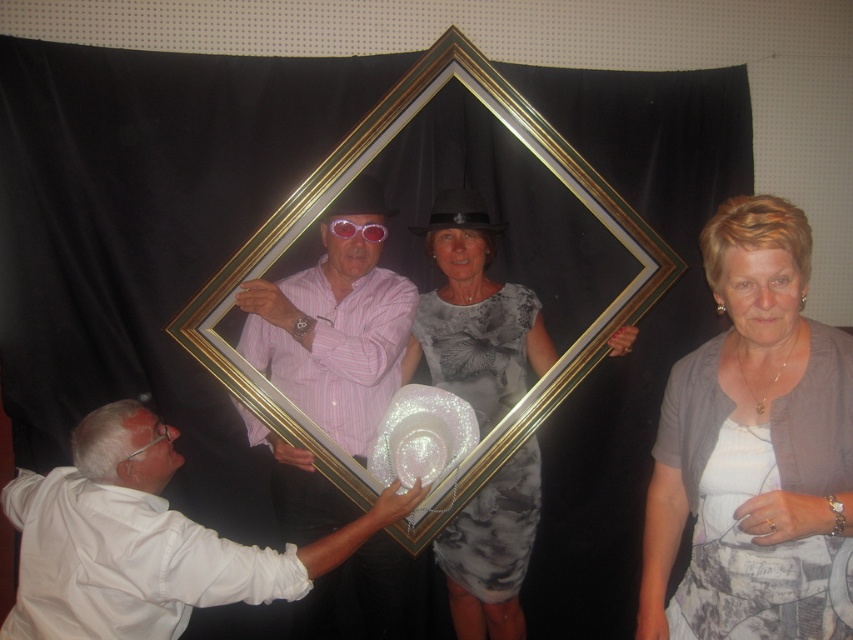
Which is behind, point (718, 342) or point (518, 364)?

Point (518, 364)

Locate an element on the screen. This screenshot has height=640, width=853. gray textured cardigan at center is located at coordinates (753, 448).

Is white matte hat at lower left thinner than pink striped shirt at center?

No, white matte hat at lower left is not thinner than pink striped shirt at center.

Does point (109, 561) come behind point (373, 220)?

No, it is not.

Which is behind, point (33, 616) or point (271, 310)?

Point (271, 310)

Identify the location of white matte hat at lower left. Image resolution: width=853 pixels, height=640 pixels. (144, 540).

Is gray textured cardigan at center to the right of white matte hat at lower left from the viewer's perspective?

Correct, you'll find gray textured cardigan at center to the right of white matte hat at lower left.

The image size is (853, 640). In order to click on gray textured cardigan at center in this screenshot , I will do `click(753, 448)`.